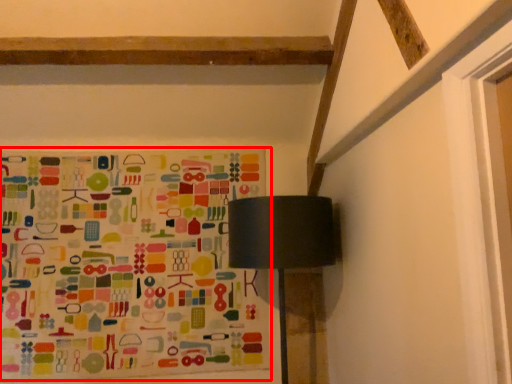
Question: From the image's perspective, what is the correct spatial relationship of bulletin board (annotated by the red box) in relation to table lamp?

Choices:
 (A) below
 (B) above

Answer: (B)